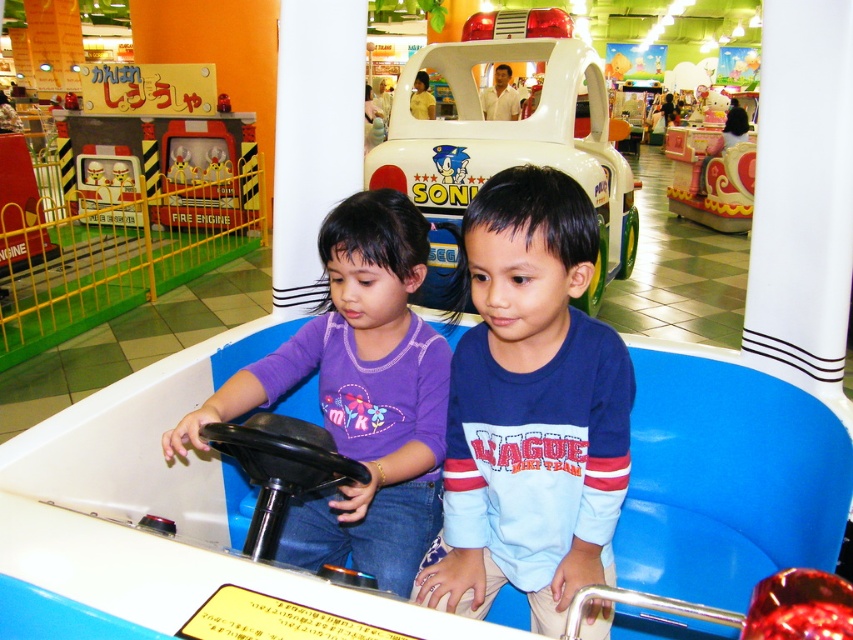
How much distance is there between purple matte shirt at center and metallic silver fire engine at center?

A distance of 22.23 feet exists between purple matte shirt at center and metallic silver fire engine at center.

Between point (392, 515) and point (131, 193), which one is positioned in front?

Point (392, 515)

Is point (363, 384) farther from camera compared to point (123, 195)?

No, it is in front of (123, 195).

Where is `purple matte shirt at center`? Image resolution: width=853 pixels, height=640 pixels. purple matte shirt at center is located at coordinates 358,396.

Can you confirm if purple matte shirt at center is positioned to the right of metallic fire engine at upper left?

Yes, purple matte shirt at center is to the right of metallic fire engine at upper left.

Is purple matte shirt at center positioned in front of metallic fire engine at upper left?

Yes, purple matte shirt at center is closer to the viewer.

The image size is (853, 640). In order to click on purple matte shirt at center in this screenshot , I will do `click(358, 396)`.

Is purple matte shirt at center to the right of metallic yellow fire engine at left from the viewer's perspective?

Indeed, purple matte shirt at center is positioned on the right side of metallic yellow fire engine at left.

Image resolution: width=853 pixels, height=640 pixels. What are the coordinates of `purple matte shirt at center` in the screenshot? It's located at (358, 396).